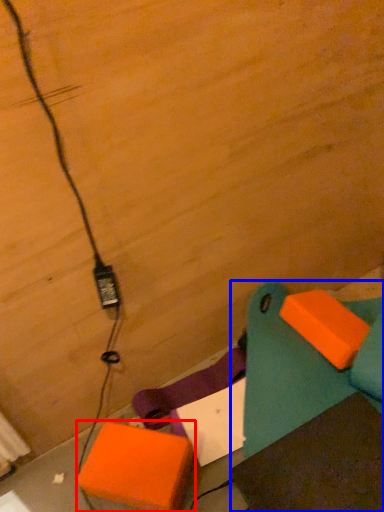
Question: Among these objects, which one is nearest to the camera, cardboard box (highlighted by a red box) or furniture (highlighted by a blue box)?

Choices:
 (A) cardboard box
 (B) furniture

Answer: (B)